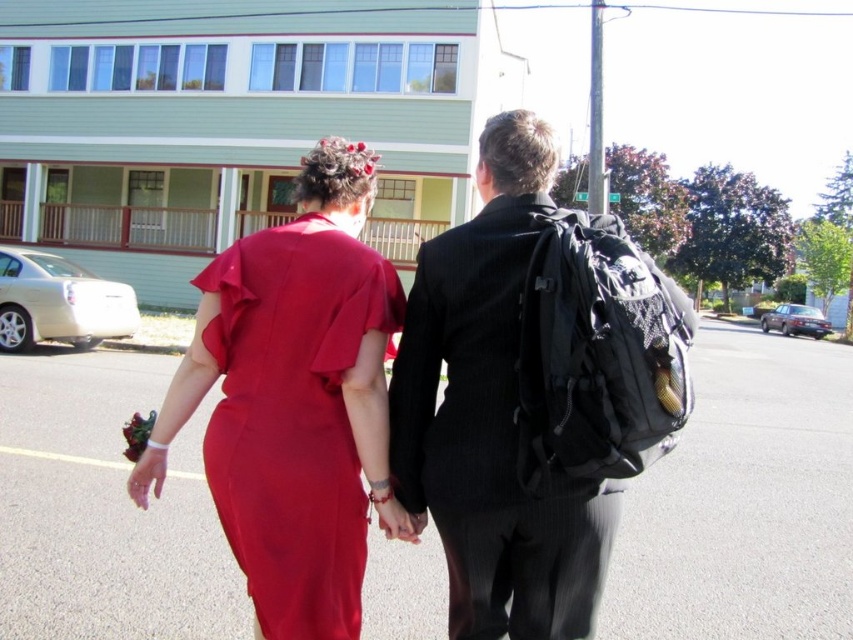
You are standing in front of the building and want to place a small decorative flag at the point closer to you between point (479,328) and point (239,371). According to the image, which point should you choose?

Point (479,328) is closer to the camera than point (239,371), so you should choose point (479,328) to place the flag.

You are a photographer trying to capture a photo of both the black pinstripe suit at center and the matte red dress at center. Since you want them to appear the same height in the photo, which one should you position closer to the camera?

The black pinstripe suit at center is taller than the matte red dress at center, so you should position the matte red dress at center closer to the camera to make them appear the same height in the photo.

You are a photographer trying to capture both the black pinstripe suit at center and the matte red dress at center in a single frame. Based on their positions, which one might require you to adjust your camera angle to include fully in the shot?

The black pinstripe suit at center might be wider than the matte red dress at center, so you might need to adjust your camera angle to ensure the black pinstripe suit at center fits fully in the frame.